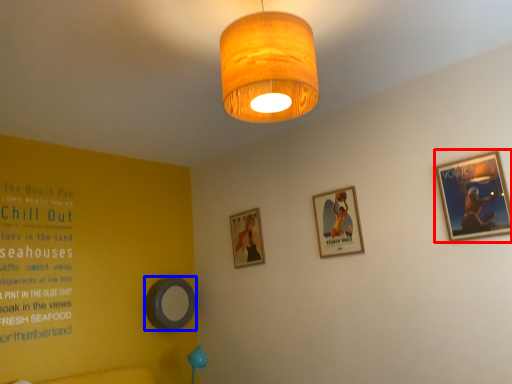
Question: Which object appears closest to the camera in this image, picture frame (highlighted by a red box) or picture frame (highlighted by a blue box)?

Choices:
 (A) picture frame
 (B) picture frame

Answer: (A)